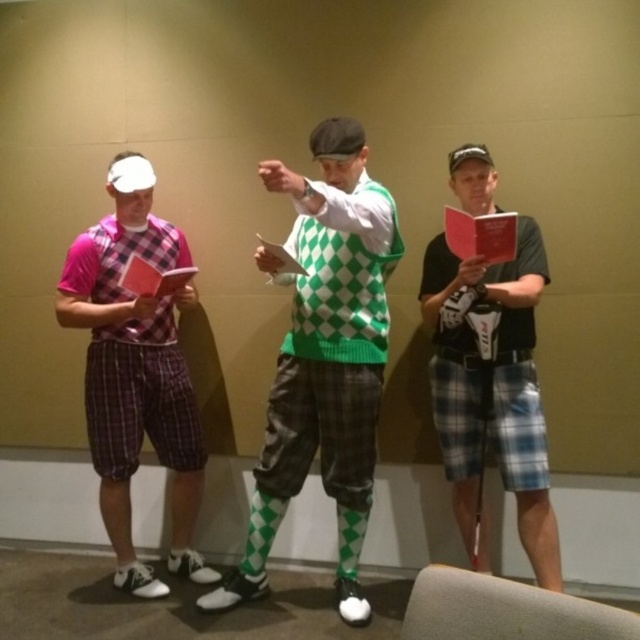
Can you confirm if red matte folder at center is wider than green checkered sock at center?

Yes, red matte folder at center is wider than green checkered sock at center.

From the picture: Is the position of red matte folder at center more distant than that of green checkered sock at center?

No, red matte folder at center is closer to the viewer.

Between point (451, 211) and point (280, 515), which one is positioned in front?

Point (451, 211)

Where is `red matte folder at center`? The image size is (640, 640). red matte folder at center is located at coordinates (481, 236).

Between point (488, 221) and point (346, 120), which one is positioned behind?

Point (346, 120)

Identify the location of red matte folder at center. (481, 236).

Does point (500, 232) lie in front of point (352, 122)?

Yes, point (500, 232) is in front of point (352, 122).

Where is `red matte folder at center`? The width and height of the screenshot is (640, 640). red matte folder at center is located at coordinates (481, 236).

Describe the element at coordinates (492, 388) in the screenshot. The image size is (640, 640). I see `gray plaid shorts at center` at that location.

Is point (515, 413) less distant than point (481, 253)?

No, it is behind (481, 253).

Is point (483, 152) positioned before point (486, 232)?

No, (483, 152) is behind (486, 232).

Locate an element on the screen. The height and width of the screenshot is (640, 640). gray plaid shorts at center is located at coordinates (492, 388).